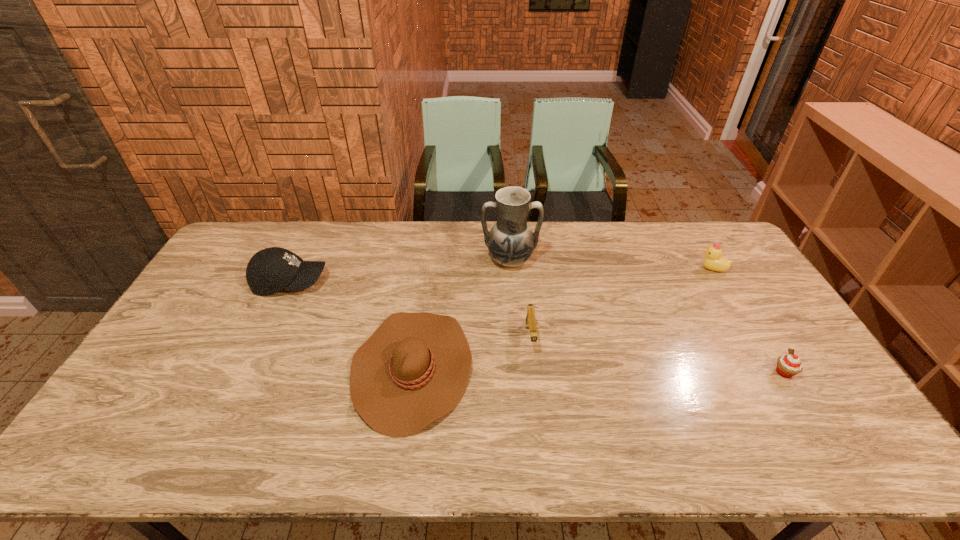
This screenshot has height=540, width=960. What are the coordinates of `the tallest object` in the screenshot? It's located at (511, 242).

This screenshot has width=960, height=540. Identify the location of the second tallest object. (271, 270).

Identify the location of the leftmost object. (271, 270).

Identify the location of duckling. This screenshot has width=960, height=540. (713, 261).

This screenshot has width=960, height=540. In order to click on pistol in this screenshot , I will do `click(530, 317)`.

The height and width of the screenshot is (540, 960). I want to click on cupcake, so click(x=790, y=365).

Find the location of a particular element. the second object from left to right is located at coordinates (414, 369).

Locate an element on the screen. This screenshot has width=960, height=540. vacant space located on the front-facing side of the pitcher is located at coordinates (516, 341).

You are a GUI agent. You are given a task and a screenshot of the screen. Output one action in this format:
    pyautogui.click(x=<x>, y=<y>)
    Task: Click on the vacant space situated on the front-facing side of the leftmost object
    
    Given the screenshot: What is the action you would take?
    pyautogui.click(x=416, y=282)

You are a GUI agent. You are given a task and a screenshot of the screen. Output one action in this format:
    pyautogui.click(x=<x>, y=<y>)
    Task: Click on the vacant space located 0.090m on the front-facing side of the third tallest object
    Image resolution: width=960 pixels, height=540 pixels.
    Given the screenshot: What is the action you would take?
    pyautogui.click(x=672, y=269)